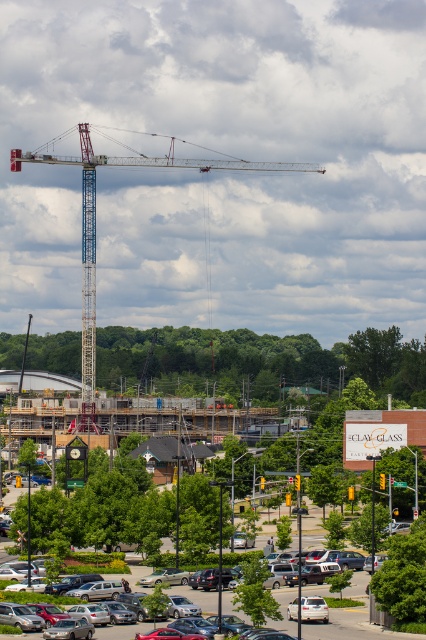
You are a delivery driver needing to park your white matte car at center near the blue metallic crane at upper left. Considering their sizes, can your car fit in the space next to the crane?

The blue metallic crane at upper left is larger than the white matte car at center, so there should be enough space for the car to park next to the crane.

Based on the photo, you are a drone operator tasked with capturing aerial footage of the blue metallic crane at upper left. Your drone has a maximum flight range of 200 meters. Based on the scene, can your drone safely reach the crane without exceeding its range?

The distance between the blue metallic crane at upper left and the camera is 206.95 meters. Since the drone can only fly up to 200 meters, it cannot safely reach the crane without exceeding its range.

You are a delivery driver who needs to park your vehicle in the construction site. You have a silver metallic sedan at lower center and a white matte car at center. Which car should you move to allow space for a larger truck arriving soon?

You should move the silver metallic sedan at lower center because it is positioned to the left of the white matte car at center, creating a pathway that can accommodate the larger truck.